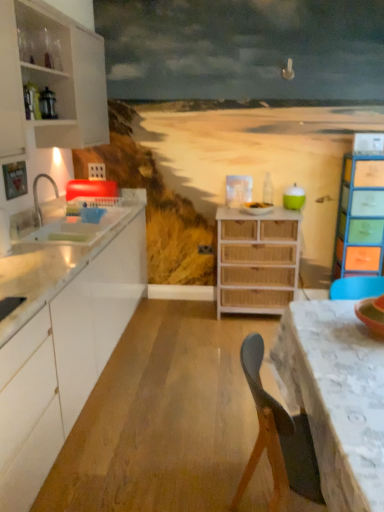
Find the location of a particular element. Image resolution: width=384 pixels, height=512 pixels. free space that is to the left of woven wood chest of drawers at center, which ranks as the 2th chest of drawers in right-to-left order is located at coordinates (195, 322).